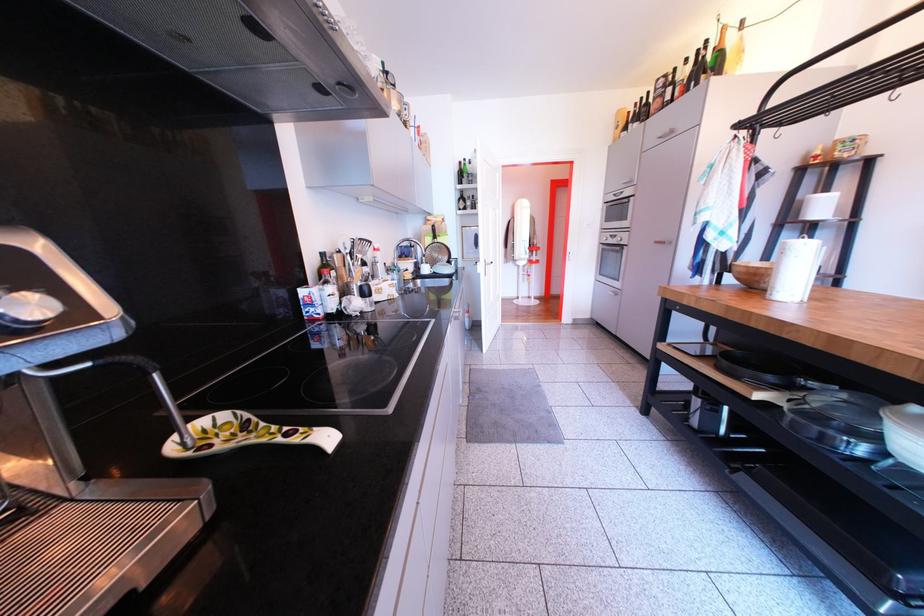
The width and height of the screenshot is (924, 616). What do you see at coordinates (489, 268) in the screenshot?
I see `a white door handle` at bounding box center [489, 268].